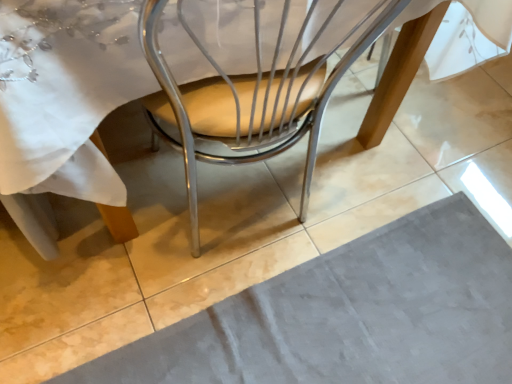
Locate an element on the screen. vacant space behind gray velvety place mat at lower center is located at coordinates (346, 178).